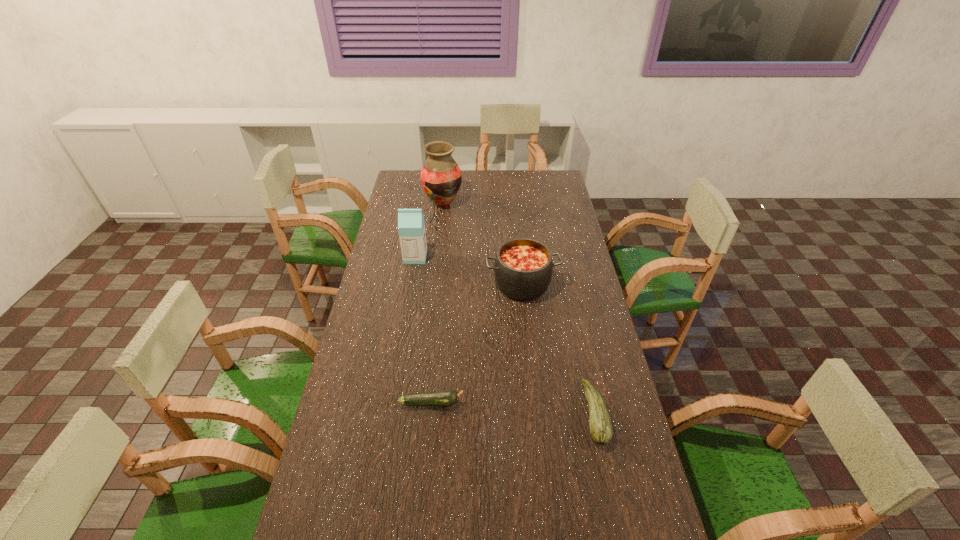
Identify the location of vacant region located on the front of the tallest object. (x=436, y=268).

What are the coordinates of `vacant region located 0.100m on the front of the second tallest object` in the screenshot? It's located at (412, 280).

The width and height of the screenshot is (960, 540). Find the location of `vacant space located 0.340m on the left of the third farthest object`. vacant space located 0.340m on the left of the third farthest object is located at coordinates (398, 284).

Locate an element on the screen. The height and width of the screenshot is (540, 960). free region located 0.120m at the stem end of the taller zucchini is located at coordinates (543, 414).

Find the location of a particular element. The width and height of the screenshot is (960, 540). vacant space located at the stem end of the taller zucchini is located at coordinates (516, 414).

I want to click on free location located 0.320m at the stem end of the taller zucchini, so click(475, 414).

You are a GUI agent. You are given a task and a screenshot of the screen. Output one action in this format:
    pyautogui.click(x=<x>, y=<y>)
    Task: Click on the vacant point located at the blossom end of the left zucchini
    This screenshot has height=540, width=960.
    Given the screenshot: What is the action you would take?
    pyautogui.click(x=564, y=403)

The height and width of the screenshot is (540, 960). What are the coordinates of `object present at the far edge` in the screenshot? It's located at (441, 177).

Identify the location of vase positioned at the left edge. The height and width of the screenshot is (540, 960). point(441,177).

I want to click on milk carton that is at the left edge, so click(411, 227).